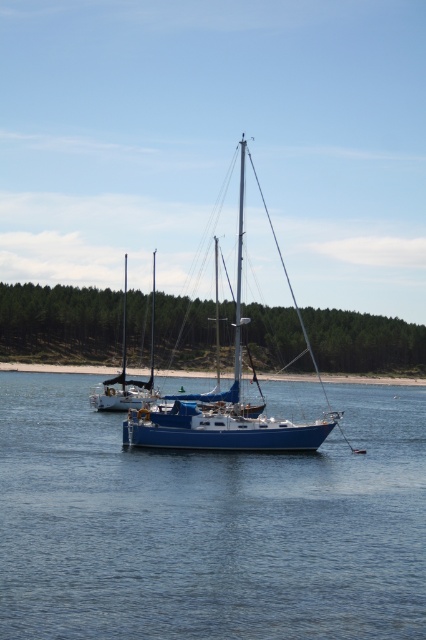
Question: Which point appears closest to the camera in this image?

Choices:
 (A) (78, 561)
 (B) (279, 253)

Answer: (A)

Question: Does blue water at center have a lesser width compared to blue matte sailboat at center?

Choices:
 (A) no
 (B) yes

Answer: (A)

Question: Is blue water at center in front of blue matte sailboat at center?

Choices:
 (A) no
 (B) yes

Answer: (B)

Question: Does blue water at center appear on the left side of blue matte sailboat at center?

Choices:
 (A) yes
 (B) no

Answer: (A)